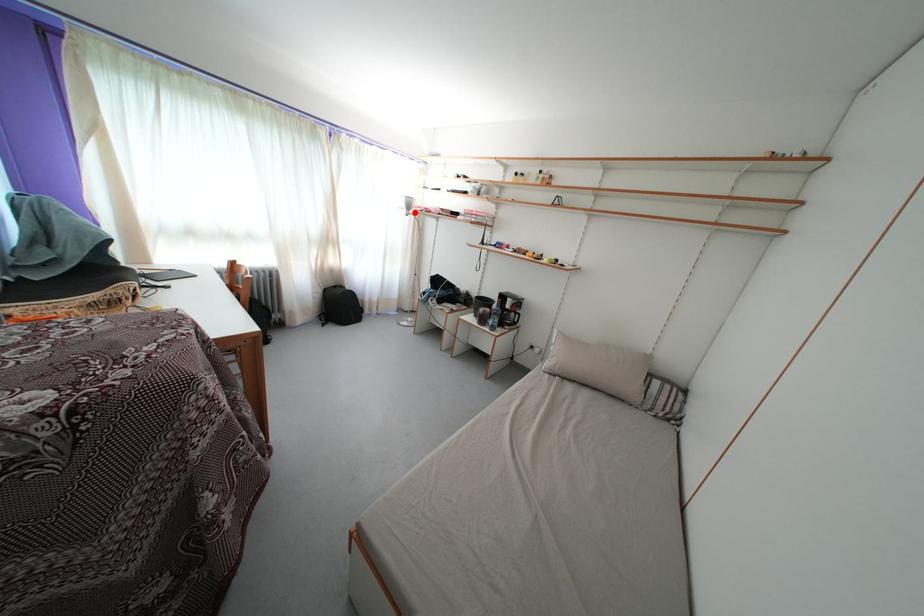
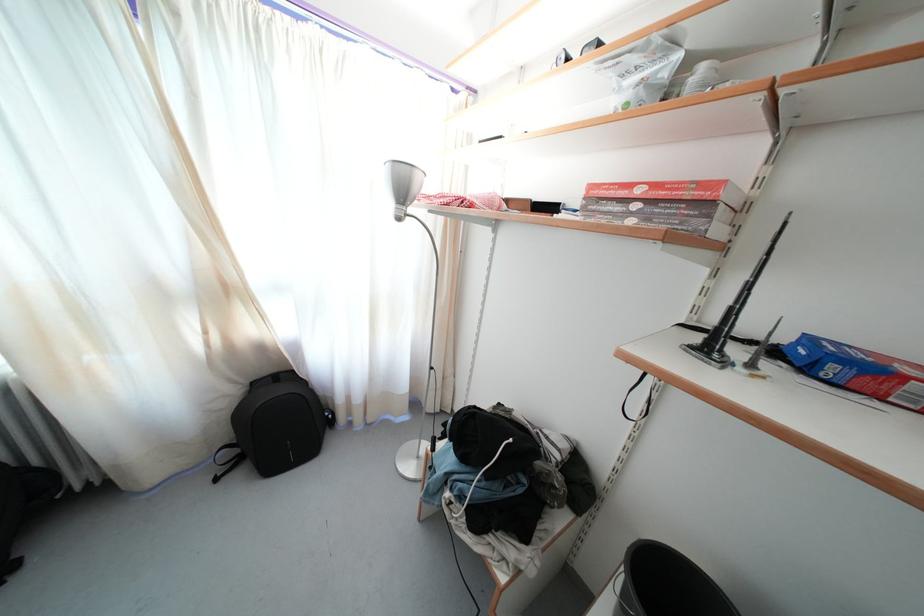
The point at the highlighted location is marked in the first image. Where is the corresponding point in the second image?

(408, 199)